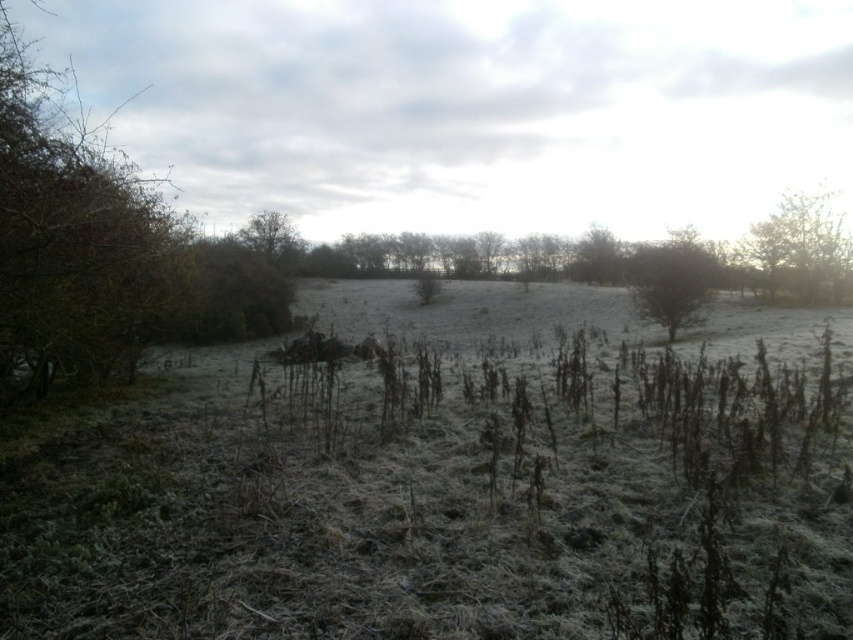
You are standing in the middle of the frosty field and want to walk towards the green matte tree at upper right and the brown textured tree at center. Which tree will you reach first?

The brown textured tree at center will be reached first because it is closer to your current position in the middle of the frosty field compared to the green matte tree at upper right, which is positioned further away.

You are standing in the open landscape and want to walk from the brown textured bush at left to the brown textured tree at center. Which direction should you move relative to the bush?

You should move to the right relative to the brown textured bush at left to reach the brown textured tree at center since the bush is on the left side of the tree.

You are standing at the center of the field and notice the brown textured bush at left. Based on its position, can you determine if it is closer to you or further away compared to the midground trees?

The brown textured bush at left is located at point (71, 241), which places it in the foreground of the image, closer to the viewer than the midground trees.